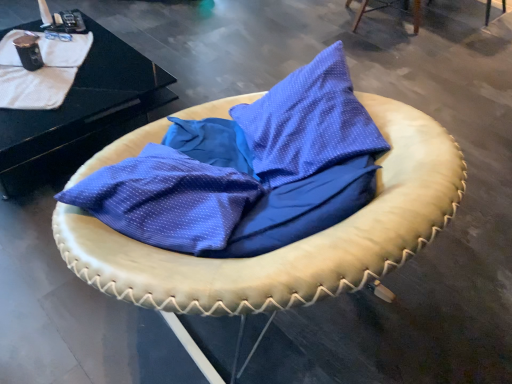
Question: Considering the relative sizes of white textured blanket at upper left and leather cushion at center, placed as the first furniture when sorted from bottom to top, in the image provided, is white textured blanket at upper left shorter than leather cushion at center, placed as the first furniture when sorted from bottom to top,?

Choices:
 (A) yes
 (B) no

Answer: (A)

Question: Is white textured blanket at upper left thinner than leather cushion at center, which is the 1th furniture in front-to-back order?

Choices:
 (A) no
 (B) yes

Answer: (B)

Question: Is white textured blanket at upper left bigger than leather cushion at center, the second furniture when ordered from right to left?

Choices:
 (A) yes
 (B) no

Answer: (B)

Question: From a real-world perspective, is white textured blanket at upper left physically above leather cushion at center, positioned as the second furniture in back-to-front order?

Choices:
 (A) yes
 (B) no

Answer: (B)

Question: Can you confirm if white textured blanket at upper left is wider than leather cushion at center, the 1th furniture from the left?

Choices:
 (A) no
 (B) yes

Answer: (A)

Question: Does white textured blanket at upper left contain leather cushion at center, the 1th furniture from the left?

Choices:
 (A) yes
 (B) no

Answer: (B)

Question: Considering the relative sizes of leather cushion at upper right, positioned as the second furniture in bottom-to-top order, and white textured blanket at upper left in the image provided, is leather cushion at upper right, positioned as the second furniture in bottom-to-top order, shorter than white textured blanket at upper left?

Choices:
 (A) no
 (B) yes

Answer: (A)

Question: Could white textured blanket at upper left be considered to be inside leather cushion at upper right, the 1th furniture viewed from the back?

Choices:
 (A) yes
 (B) no

Answer: (B)

Question: Is leather cushion at upper right, the first furniture from the right, not inside white textured blanket at upper left?

Choices:
 (A) yes
 (B) no

Answer: (A)

Question: Does leather cushion at upper right, the 1th furniture viewed from the back, have a larger size compared to white textured blanket at upper left?

Choices:
 (A) yes
 (B) no

Answer: (A)

Question: Is leather cushion at upper right, positioned as the second furniture in bottom-to-top order, smaller than white textured blanket at upper left?

Choices:
 (A) no
 (B) yes

Answer: (A)

Question: Is black glossy table at upper left not inside leather cushion at center, the second furniture positioned from the top?

Choices:
 (A) yes
 (B) no

Answer: (A)